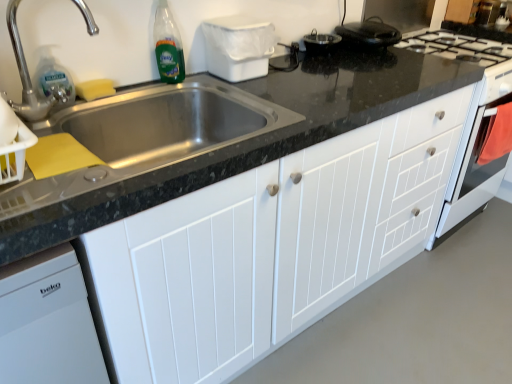
Question: Relative to white wood cabinet at center, is silver metallic faucet at upper left in front or behind?

Choices:
 (A) behind
 (B) front

Answer: (A)

Question: From the image's perspective, is silver metallic faucet at upper left positioned above or below white wood cabinet at center?

Choices:
 (A) below
 (B) above

Answer: (B)

Question: Based on their relative distances, which object is nearer to the green glass bottle at upper left?

Choices:
 (A) clear plastic bottle at sink left
 (B) silver metallic faucet at upper left
 (C) white wood cabinet at center

Answer: (A)

Question: Which object is positioned closest to the white wood cabinet at center?

Choices:
 (A) silver metallic faucet at upper left
 (B) green glass bottle at upper left
 (C) clear plastic bottle at sink left

Answer: (B)